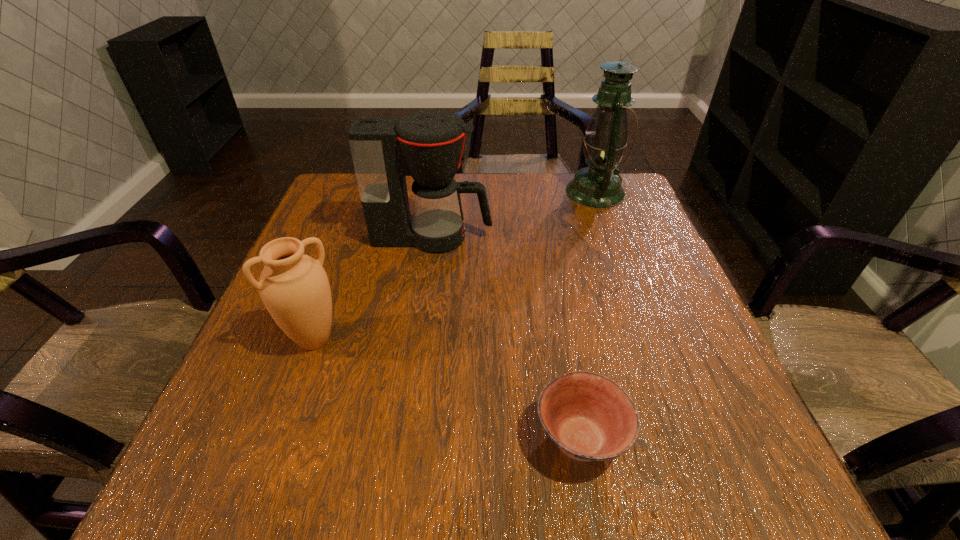
Locate an element on the screen. This screenshot has height=540, width=960. the farthest object is located at coordinates pos(598,186).

Where is `the rightmost object`? The image size is (960, 540). the rightmost object is located at coordinates (598, 186).

Identify the location of coffee maker. The height and width of the screenshot is (540, 960). (428, 145).

Locate an element on the screen. The height and width of the screenshot is (540, 960). the third nearest object is located at coordinates [428, 145].

The image size is (960, 540). What are the coordinates of `urn` in the screenshot? It's located at coord(294,287).

Find the location of `the third farthest object`. the third farthest object is located at coordinates (294, 287).

You are a GUI agent. You are given a task and a screenshot of the screen. Output one action in this format:
    pyautogui.click(x=<x>, y=<y>)
    Task: Click on the third object from left to right
    The height and width of the screenshot is (540, 960).
    Given the screenshot: What is the action you would take?
    pyautogui.click(x=588, y=416)

At what (x,y) coordinates should I click in order to perform the action: click on the shortest object. Please return your answer as a coordinate pair (x, y). Looking at the image, I should click on (588, 416).

Where is `free space located 0.100m on the front of the rightmost object`? This screenshot has height=540, width=960. free space located 0.100m on the front of the rightmost object is located at coordinates (611, 232).

Locate an element on the screen. The width and height of the screenshot is (960, 540). free space located 0.160m pour from the carafe of the third nearest object is located at coordinates (558, 237).